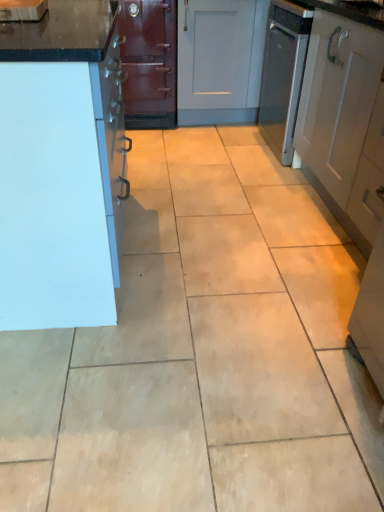
Question: Is white matte cabinet at right, which is the first cabinetry from right to left, outside of white matte cabinet at left, which appears as the second cabinetry when viewed from the right?

Choices:
 (A) yes
 (B) no

Answer: (A)

Question: Would you say white matte cabinet at right, positioned as the 2th cabinetry in left-to-right order, is a long distance from white matte cabinet at left, which appears as the second cabinetry when viewed from the right?

Choices:
 (A) yes
 (B) no

Answer: (A)

Question: Can you see white matte cabinet at right, positioned as the 2th cabinetry in left-to-right order, touching white matte cabinet at left, which appears as the second cabinetry when viewed from the right?

Choices:
 (A) no
 (B) yes

Answer: (A)

Question: From the image's perspective, is white matte cabinet at right, positioned as the 2th cabinetry in left-to-right order, over white matte cabinet at left, which appears as the second cabinetry when viewed from the right?

Choices:
 (A) yes
 (B) no

Answer: (A)

Question: Is white matte cabinet at right, which is the first cabinetry from right to left, to the left of white matte cabinet at left, the 1th cabinetry from the left, from the viewer's perspective?

Choices:
 (A) yes
 (B) no

Answer: (B)

Question: Considering the relative sizes of white matte cabinet at right, positioned as the 2th cabinetry in left-to-right order, and white matte cabinet at left, the 1th cabinetry from the left, in the image provided, is white matte cabinet at right, positioned as the 2th cabinetry in left-to-right order, smaller than white matte cabinet at left, the 1th cabinetry from the left,?

Choices:
 (A) no
 (B) yes

Answer: (B)

Question: Is the position of white matte cabinet at left, which appears as the second cabinetry when viewed from the right, less distant than that of white matte cabinet at right, which is the first cabinetry from right to left?

Choices:
 (A) yes
 (B) no

Answer: (A)

Question: Considering the relative positions of white matte cabinet at left, the 1th cabinetry from the left, and white matte cabinet at right, positioned as the 2th cabinetry in left-to-right order, in the image provided, is white matte cabinet at left, the 1th cabinetry from the left, to the left of white matte cabinet at right, positioned as the 2th cabinetry in left-to-right order, from the viewer's perspective?

Choices:
 (A) yes
 (B) no

Answer: (A)

Question: Is white matte cabinet at left, which appears as the second cabinetry when viewed from the right, thinner than white matte cabinet at right, which is the first cabinetry from right to left?

Choices:
 (A) no
 (B) yes

Answer: (A)

Question: Does white matte cabinet at left, which appears as the second cabinetry when viewed from the right, have a lesser height compared to white matte cabinet at right, positioned as the 2th cabinetry in left-to-right order?

Choices:
 (A) no
 (B) yes

Answer: (B)

Question: From a real-world perspective, is white matte cabinet at left, the 1th cabinetry from the left, beneath white matte cabinet at right, which is the first cabinetry from right to left?

Choices:
 (A) no
 (B) yes

Answer: (B)

Question: Is white matte cabinet at left, the 1th cabinetry from the left, far away from white matte cabinet at right, positioned as the 2th cabinetry in left-to-right order?

Choices:
 (A) yes
 (B) no

Answer: (A)

Question: Is point (367, 109) closer or farther from the camera than point (46, 236)?

Choices:
 (A) farther
 (B) closer

Answer: (A)